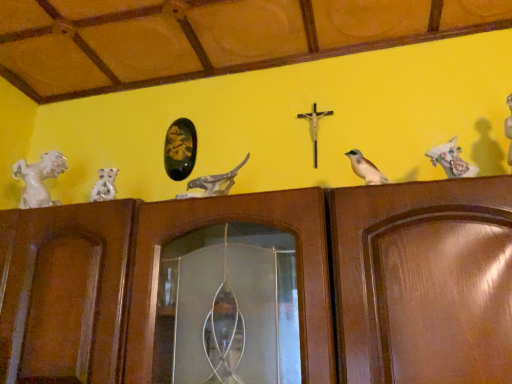
Question: Is brown wood door at center surrounding white glossy horse at left, arranged as the first animal when viewed from the left?

Choices:
 (A) no
 (B) yes

Answer: (A)

Question: From a real-world perspective, is brown wood door at center positioned over white glossy horse at left, which is the fourth animal from right to left, based on gravity?

Choices:
 (A) no
 (B) yes

Answer: (A)

Question: Is brown wood door at center to the right of white glossy horse at left, arranged as the first animal when viewed from the left, from the viewer's perspective?

Choices:
 (A) no
 (B) yes

Answer: (B)

Question: From a real-world perspective, is brown wood door at center under white glossy horse at left, arranged as the first animal when viewed from the left?

Choices:
 (A) yes
 (B) no

Answer: (A)

Question: Does brown wood door at center have a larger size compared to white glossy horse at left, which is the fourth animal from right to left?

Choices:
 (A) yes
 (B) no

Answer: (A)

Question: Considering the relative sizes of brown wood door at center and white glossy horse at left, arranged as the first animal when viewed from the left, in the image provided, is brown wood door at center thinner than white glossy horse at left, arranged as the first animal when viewed from the left,?

Choices:
 (A) yes
 (B) no

Answer: (B)

Question: Is matte gray stone bird at center, the 2th animal when ordered from right to left, aimed at brown wood door at center?

Choices:
 (A) no
 (B) yes

Answer: (A)

Question: Is matte gray stone bird at center, which is the 3th animal from left to right, shorter than brown wood door at center?

Choices:
 (A) yes
 (B) no

Answer: (A)

Question: Is the position of matte gray stone bird at center, which is the 3th animal from left to right, more distant than that of brown wood door at center?

Choices:
 (A) yes
 (B) no

Answer: (A)

Question: Considering the relative positions of matte gray stone bird at center, the 2th animal when ordered from right to left, and brown wood door at center in the image provided, is matte gray stone bird at center, the 2th animal when ordered from right to left, to the right of brown wood door at center from the viewer's perspective?

Choices:
 (A) no
 (B) yes

Answer: (B)

Question: Is matte gray stone bird at center, which is the 3th animal from left to right, completely or partially outside of brown wood door at center?

Choices:
 (A) yes
 (B) no

Answer: (A)

Question: From the image's perspective, is matte gray stone bird at center, which is the 3th animal from left to right, below brown wood door at center?

Choices:
 (A) no
 (B) yes

Answer: (A)

Question: Considering the relative sizes of white glossy horse at left, which is the fourth animal from right to left, and matte gray stone bird at center, which is the 3th animal from left to right, in the image provided, is white glossy horse at left, which is the fourth animal from right to left, smaller than matte gray stone bird at center, which is the 3th animal from left to right,?

Choices:
 (A) yes
 (B) no

Answer: (A)